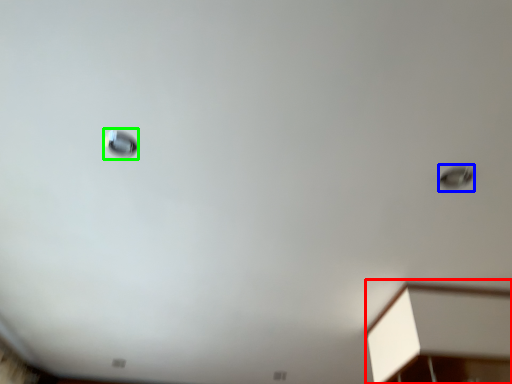
Question: Which is farther away from furniture (highlighted by a red box)? droplight (highlighted by a blue box) or droplight (highlighted by a green box)?

Choices:
 (A) droplight
 (B) droplight

Answer: (B)